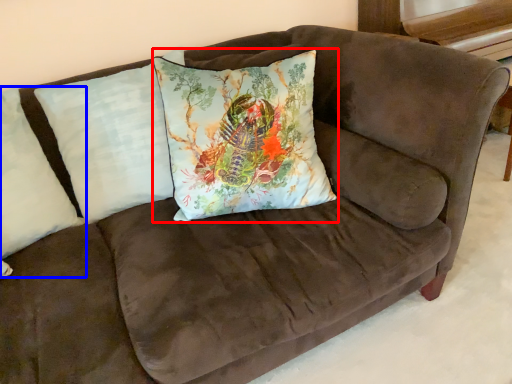
Question: Which point is further to the camera, pillow (highlighted by a red box) or pillow (highlighted by a blue box)?

Choices:
 (A) pillow
 (B) pillow

Answer: (A)